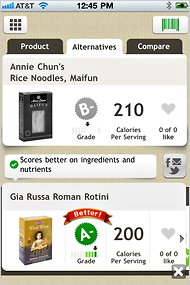
Locate an element on the screen. This screenshot has height=285, width=190. wifi is located at coordinates (45, 6).